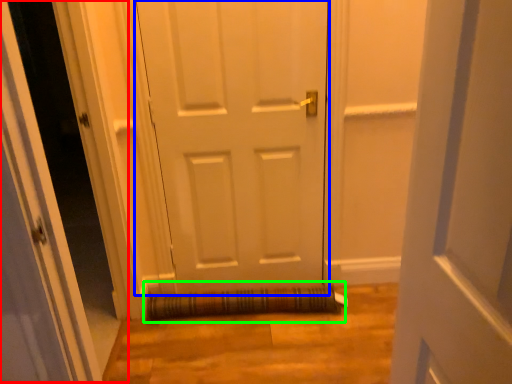
Question: Estimate the real-world distances between objects in this image. Which object is farther from glass door (highlighted by a red box), door (highlighted by a blue box) or doormat (highlighted by a green box)?

Choices:
 (A) door
 (B) doormat

Answer: (A)